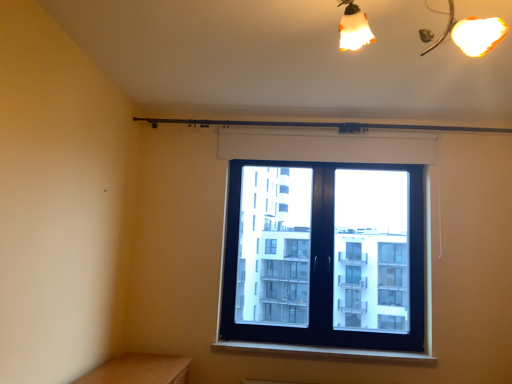
Question: From the image's perspective, is white plastic window sill at lower center on top of black plastic window at center?

Choices:
 (A) no
 (B) yes

Answer: (A)

Question: Is white plastic window sill at lower center facing towards black plastic window at center?

Choices:
 (A) yes
 (B) no

Answer: (B)

Question: From a real-world perspective, is white plastic window sill at lower center below black plastic window at center?

Choices:
 (A) no
 (B) yes

Answer: (B)

Question: Is white plastic window sill at lower center far from black plastic window at center?

Choices:
 (A) no
 (B) yes

Answer: (B)

Question: Can you confirm if white plastic window sill at lower center is wider than black plastic window at center?

Choices:
 (A) no
 (B) yes

Answer: (B)

Question: Considering their positions, is white plastic window sill at lower center located in front of or behind black plastic window at center?

Choices:
 (A) front
 (B) behind

Answer: (A)

Question: Considering the positions of white plastic window sill at lower center and black plastic window at center in the image, is white plastic window sill at lower center taller or shorter than black plastic window at center?

Choices:
 (A) short
 (B) tall

Answer: (A)

Question: Would you say white plastic window sill at lower center is inside or outside black plastic window at center?

Choices:
 (A) inside
 (B) outside

Answer: (B)

Question: Considering the positions of white plastic window sill at lower center and black plastic window at center in the image, is white plastic window sill at lower center wider or thinner than black plastic window at center?

Choices:
 (A) thin
 (B) wide

Answer: (B)

Question: Looking at their shapes, would you say white matte shutter at upper center is wider or thinner than black plastic window at center?

Choices:
 (A) thin
 (B) wide

Answer: (A)

Question: Is white matte shutter at upper center in front of or behind black plastic window at center in the image?

Choices:
 (A) front
 (B) behind

Answer: (B)

Question: Based on their sizes in the image, would you say white matte shutter at upper center is bigger or smaller than black plastic window at center?

Choices:
 (A) small
 (B) big

Answer: (A)

Question: Is white matte shutter at upper center spatially inside black plastic window at center, or outside of it?

Choices:
 (A) inside
 (B) outside

Answer: (B)

Question: Looking at the image, does white matte shutter at upper center seem bigger or smaller compared to white plastic window sill at lower center?

Choices:
 (A) big
 (B) small

Answer: (B)

Question: From the image's perspective, relative to white plastic window sill at lower center, is white matte shutter at upper center above or below?

Choices:
 (A) below
 (B) above

Answer: (B)